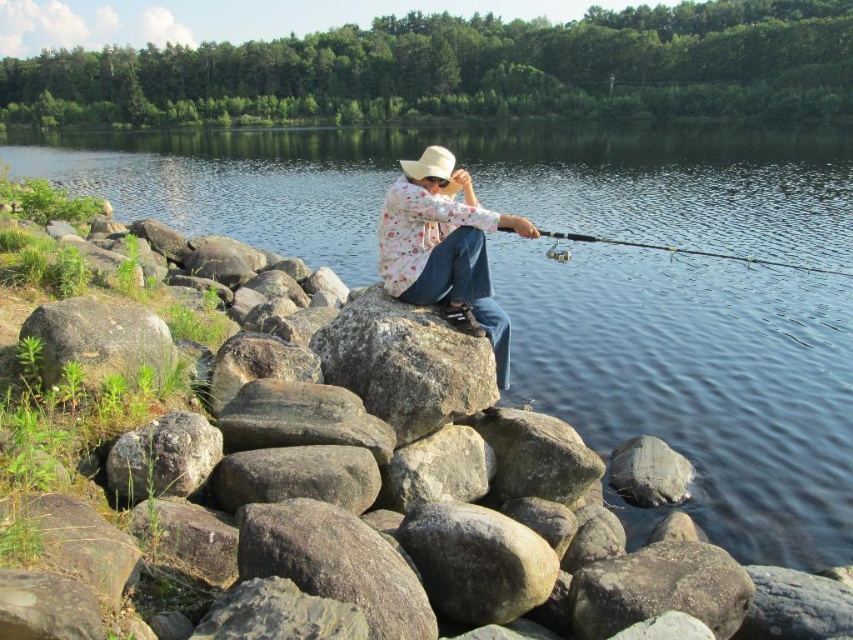
Between point (737, 138) and point (619, 445), which one is positioned behind?

Point (737, 138)

This screenshot has width=853, height=640. I want to click on clear water at center, so click(x=474, y=180).

Can you confirm if clear water at center is wider than white woven cowboy hat at center?

Indeed, clear water at center has a greater width compared to white woven cowboy hat at center.

Identify the location of clear water at center. This screenshot has width=853, height=640. (474, 180).

Does point (393, 358) come behind point (422, 152)?

No.

Which is in front, point (402, 429) or point (433, 161)?

Positioned in front is point (402, 429).

I want to click on gray rough rock at center, so click(405, 364).